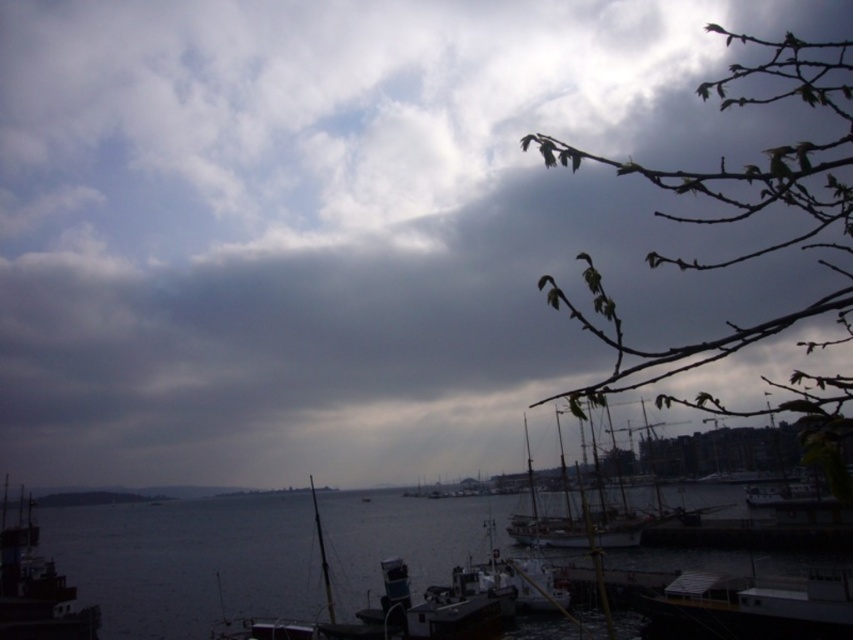
You are standing at the point with coordinates point (35, 586) in the harbor scene. What object are you standing on?

You are standing on the metallic gray boat at lower left.

You are standing at the edge of the harbor looking out. You see two points marked in the scene. The first point is at coordinates point (38, 595) and the second point is at point (612, 509). Which point is closer to you?

Point (38, 595) is in front of point (612, 509), so the first point is closer to you.

You are standing on the dock and see the dark water at lower center and the metallic gray boat at lower left. Which object is positioned to the right of the other?

The dark water at lower center is positioned to the right of the metallic gray boat at lower left.